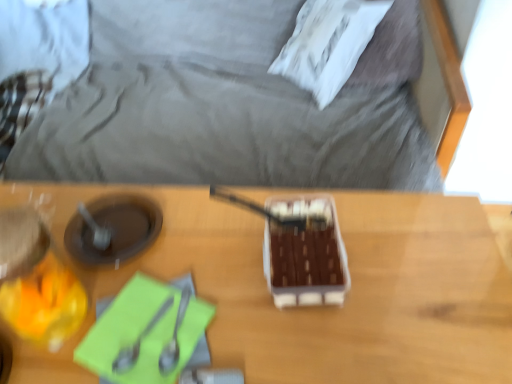
Question: Is white soft pillow at upper center thinner than wooden table at center?

Choices:
 (A) no
 (B) yes

Answer: (B)

Question: Is white soft pillow at upper center turned away from wooden table at center?

Choices:
 (A) no
 (B) yes

Answer: (A)

Question: Is white soft pillow at upper center surrounding wooden table at center?

Choices:
 (A) no
 (B) yes

Answer: (A)

Question: Are white soft pillow at upper center and wooden table at center far apart?

Choices:
 (A) yes
 (B) no

Answer: (B)

Question: Considering the relative sizes of white soft pillow at upper center and wooden table at center in the image provided, is white soft pillow at upper center shorter than wooden table at center?

Choices:
 (A) yes
 (B) no

Answer: (A)

Question: From the image's perspective, is brown matte chocolate bar at center above or below green matte notepad at lower left?

Choices:
 (A) above
 (B) below

Answer: (A)

Question: Based on their sizes in the image, would you say brown matte chocolate bar at center is bigger or smaller than green matte notepad at lower left?

Choices:
 (A) small
 (B) big

Answer: (B)

Question: From a real-world perspective, is brown matte chocolate bar at center physically located above or below green matte notepad at lower left?

Choices:
 (A) above
 (B) below

Answer: (A)

Question: Looking at their shapes, would you say brown matte chocolate bar at center is wider or thinner than green matte notepad at lower left?

Choices:
 (A) thin
 (B) wide

Answer: (A)

Question: From the image's perspective, is satin silver spoon at center, marked as the 1th utensil in a right-to-left arrangement, located above or below satin silver spoon at lower left, which is the second utensil in right-to-left order?

Choices:
 (A) above
 (B) below

Answer: (A)

Question: Is point (172, 347) closer or farther from the camera than point (119, 367)?

Choices:
 (A) farther
 (B) closer

Answer: (A)

Question: Is satin silver spoon at center, marked as the 1th utensil in a right-to-left arrangement, taller or shorter than satin silver spoon at lower left, which is the second utensil in right-to-left order?

Choices:
 (A) tall
 (B) short

Answer: (B)

Question: Is satin silver spoon at center, marked as the 1th utensil in a right-to-left arrangement, bigger or smaller than satin silver spoon at lower left, placed as the 1th utensil when sorted from left to right?

Choices:
 (A) small
 (B) big

Answer: (A)

Question: Do you think wooden table at center is within brown matte chocolate bar at center, or outside of it?

Choices:
 (A) inside
 (B) outside

Answer: (B)

Question: Is wooden table at center wider or thinner than brown matte chocolate bar at center?

Choices:
 (A) wide
 (B) thin

Answer: (A)